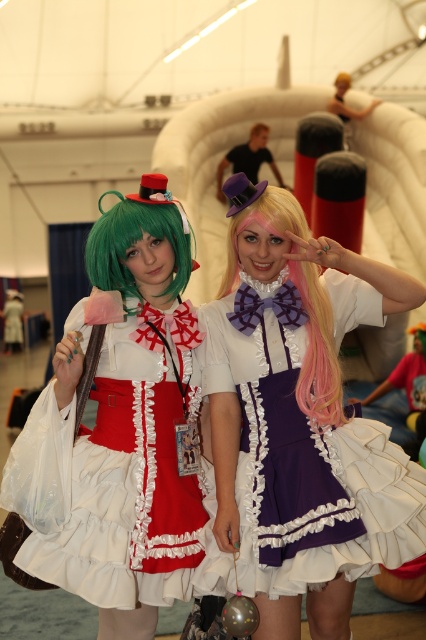
Is the position of purple satin dress at center more distant than that of pink silky wig at center?

No, it is in front of pink silky wig at center.

Between point (385, 554) and point (305, 273), which one is positioned in front?

Point (385, 554)

Where is `purple satin dress at center`? This screenshot has width=426, height=640. purple satin dress at center is located at coordinates (299, 422).

Is point (373, 508) in front of point (101, 276)?

Yes, point (373, 508) is in front of point (101, 276).

Consider the image. Measure the distance between point (288,440) and camera.

Point (288,440) is 2.98 meters away from camera.

What do you see at coordinates (299, 422) in the screenshot? I see `purple satin dress at center` at bounding box center [299, 422].

Where is `purple satin dress at center`? purple satin dress at center is located at coordinates (299, 422).

What do you see at coordinates (120, 426) in the screenshot? Image resolution: width=426 pixels, height=640 pixels. I see `matte white dress at center` at bounding box center [120, 426].

Between matte white dress at center and green matte wig at left, which one appears on the right side from the viewer's perspective?

Positioned to the right is green matte wig at left.

Is point (166, 324) closer to camera compared to point (172, 282)?

Yes, point (166, 324) is in front of point (172, 282).

Locate an element on the screen. This screenshot has height=640, width=426. matte white dress at center is located at coordinates (120, 426).